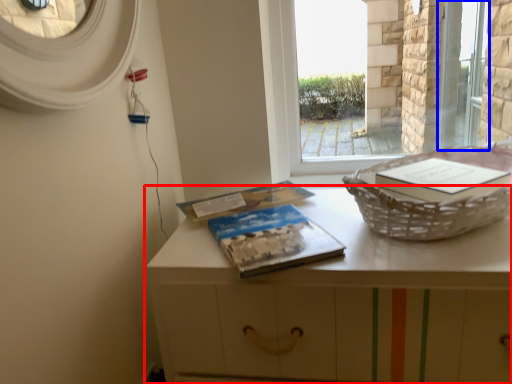
Question: Which object is closer to the camera taking this photo, table (highlighted by a red box) or screen door (highlighted by a blue box)?

Choices:
 (A) table
 (B) screen door

Answer: (A)